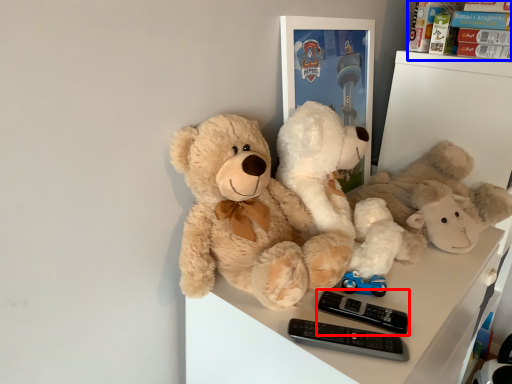
Question: Among these objects, which one is nearest to the camera, control (highlighted by a red box) or toy (highlighted by a blue box)?

Choices:
 (A) control
 (B) toy

Answer: (A)